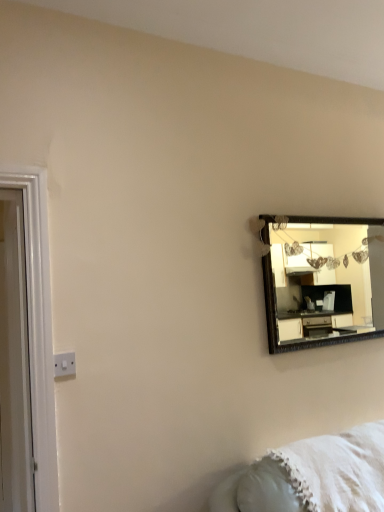
The height and width of the screenshot is (512, 384). I want to click on white fluffy blanket at lower right, so point(338,469).

What do you see at coordinates (323, 281) in the screenshot? I see `wooden-framed mirror at upper right` at bounding box center [323, 281].

At what (x,y) coordinates should I click in order to perform the action: click on wooden-framed mirror at upper right. Please return your answer as a coordinate pair (x, y). The image size is (384, 512). Looking at the image, I should click on (323, 281).

Locate an element on the screen. The image size is (384, 512). white plastic switch at lower left is located at coordinates (64, 364).

You are a GUI agent. You are given a task and a screenshot of the screen. Output one action in this format:
    pyautogui.click(x=<x>, y=<y>)
    Task: Click on the white fluffy blanket at lower right
    The image size is (384, 512).
    Given the screenshot: What is the action you would take?
    pyautogui.click(x=338, y=469)

Locate an element on the screen. electric outlet on the right of white glossy door at left is located at coordinates (64, 364).

Which of these two, white plastic switch at lower left or white glossy door at left, is wider?

white glossy door at left is wider.

From a real-world perspective, which is physically below, white plastic switch at lower left or white glossy door at left?

white plastic switch at lower left.

From a real-world perspective, is white plastic switch at lower left above or below wooden-framed mirror at upper right?

From a real-world perspective, white plastic switch at lower left is physically below wooden-framed mirror at upper right.

Does white plastic switch at lower left have a smaller size compared to wooden-framed mirror at upper right?

Yes.

Locate an element on the screen. The width and height of the screenshot is (384, 512). mirror above the white plastic switch at lower left (from a real-world perspective) is located at coordinates (323, 281).

Based on the photo, does white plastic switch at lower left come in front of wooden-framed mirror at upper right?

Yes, white plastic switch at lower left is in front of wooden-framed mirror at upper right.

The width and height of the screenshot is (384, 512). I want to click on mirror located on the right of white glossy door at left, so click(x=323, y=281).

In the image, is white glossy door at left positioned in front of or behind wooden-framed mirror at upper right?

Visually, white glossy door at left is located in front of wooden-framed mirror at upper right.

Is white glossy door at left turned away from wooden-framed mirror at upper right?

No, white glossy door at left is not facing the opposite direction of wooden-framed mirror at upper right.

Between white glossy door at left and wooden-framed mirror at upper right, which one has more height?

Standing taller between the two is white glossy door at left.

Considering the relative sizes of white plastic switch at lower left and white fluffy blanket at lower right in the image provided, is white plastic switch at lower left smaller than white fluffy blanket at lower right?

Yes.

Consider the image. Who is shorter, white plastic switch at lower left or white fluffy blanket at lower right?

white plastic switch at lower left is shorter.

Looking at this image, from the image's perspective, who appears lower, wooden-framed mirror at upper right or white glossy door at left?

white glossy door at left.

Does wooden-framed mirror at upper right have a greater height compared to white glossy door at left?

In fact, wooden-framed mirror at upper right may be shorter than white glossy door at left.

This screenshot has height=512, width=384. What are the coordinates of `mirror above the white glossy door at left (from the image's perspective)` in the screenshot? It's located at (323, 281).

Based on the photo, is white glossy door at left at the back of wooden-framed mirror at upper right?

No, wooden-framed mirror at upper right is not facing away from white glossy door at left.

From a real-world perspective, does white fluffy blanket at lower right sit lower than white glossy door at left?

Yes, from a real-world perspective, white fluffy blanket at lower right is below white glossy door at left.

Is white fluffy blanket at lower right not within white glossy door at left?

That's correct, white fluffy blanket at lower right is outside of white glossy door at left.

Are white fluffy blanket at lower right and white glossy door at left making contact?

No, white fluffy blanket at lower right is not next to white glossy door at left.

Does white glossy door at left have a greater height compared to white plastic switch at lower left?

Correct, white glossy door at left is much taller as white plastic switch at lower left.

Is white glossy door at left positioned with its back to white plastic switch at lower left?

white glossy door at left is not turned away from white plastic switch at lower left.

Is white plastic switch at lower left completely or partially inside white glossy door at left?

Actually, white plastic switch at lower left is outside white glossy door at left.

Is white glossy door at left bigger or smaller than white plastic switch at lower left?

Clearly, white glossy door at left is larger in size than white plastic switch at lower left.

Where is `door located above the white plastic switch at lower left (from a real-world perspective)`? This screenshot has height=512, width=384. door located above the white plastic switch at lower left (from a real-world perspective) is located at coordinates (14, 362).

Identify the location of electric outlet to the left of wooden-framed mirror at upper right. Image resolution: width=384 pixels, height=512 pixels. (64, 364).

Based on their spatial positions, is white plastic switch at lower left or white glossy door at left further from wooden-framed mirror at upper right?

white glossy door at left lies further to wooden-framed mirror at upper right than the other object.

Looking at the image, which one is located further to wooden-framed mirror at upper right, white fluffy blanket at lower right or white glossy door at left?

Based on the image, white glossy door at left appears to be further to wooden-framed mirror at upper right.

When comparing their distances from wooden-framed mirror at upper right, does white glossy door at left or white plastic switch at lower left seem further?

white glossy door at left.

Based on their spatial positions, is wooden-framed mirror at upper right or white glossy door at left closer to white plastic switch at lower left?

The object closer to white plastic switch at lower left is white glossy door at left.

From the image, which object appears to be nearer to white glossy door at left, wooden-framed mirror at upper right or white plastic switch at lower left?

white plastic switch at lower left is positioned closer to the anchor white glossy door at left.

In the scene shown: Considering their positions, is white glossy door at left positioned closer to white plastic switch at lower left than white fluffy blanket at lower right?

white glossy door at left lies closer to white plastic switch at lower left than the other object.

When comparing their distances from white glossy door at left, does white plastic switch at lower left or wooden-framed mirror at upper right seem further?

wooden-framed mirror at upper right is further to white glossy door at left.

Based on their spatial positions, is white fluffy blanket at lower right or white plastic switch at lower left closer to white glossy door at left?

Among the two, white plastic switch at lower left is located nearer to white glossy door at left.

Locate an element on the screen. This screenshot has width=384, height=512. electric outlet located between white glossy door at left and white fluffy blanket at lower right in the left-right direction is located at coordinates (64, 364).

Identify the location of mirror between white glossy door at left and white fluffy blanket at lower right in the horizontal direction. The height and width of the screenshot is (512, 384). (323, 281).

At what (x,y) coordinates should I click in order to perform the action: click on mirror located between white plastic switch at lower left and white fluffy blanket at lower right in the left-right direction. Please return your answer as a coordinate pair (x, y). This screenshot has height=512, width=384. Looking at the image, I should click on (323, 281).

Where is `electric outlet located between white glossy door at left and wooden-framed mirror at upper right in the left-right direction`? electric outlet located between white glossy door at left and wooden-framed mirror at upper right in the left-right direction is located at coordinates (64, 364).